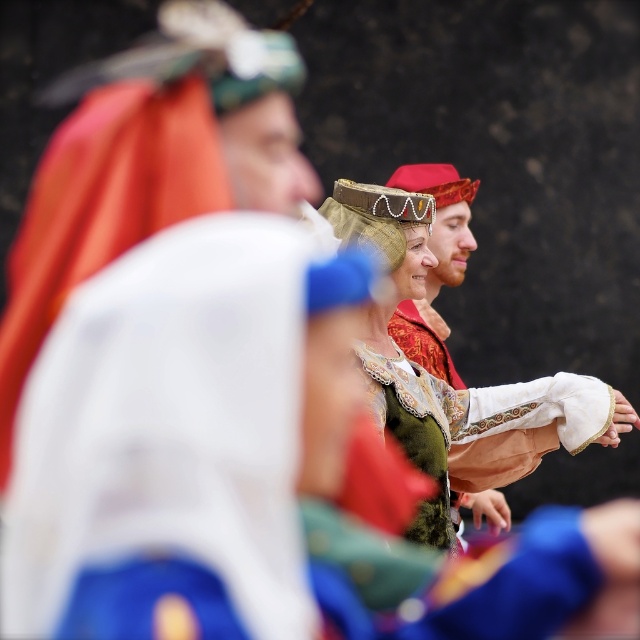
Between green velvet dress at center and matte gold helmet at center, which one appears on the left side from the viewer's perspective?

Positioned to the left is green velvet dress at center.

Does green velvet dress at center have a lesser height compared to matte gold helmet at center?

Yes, green velvet dress at center is shorter than matte gold helmet at center.

Between point (90, 436) and point (476, 180), which one is positioned in front?

Point (90, 436)

I want to click on green velvet dress at center, so click(x=218, y=461).